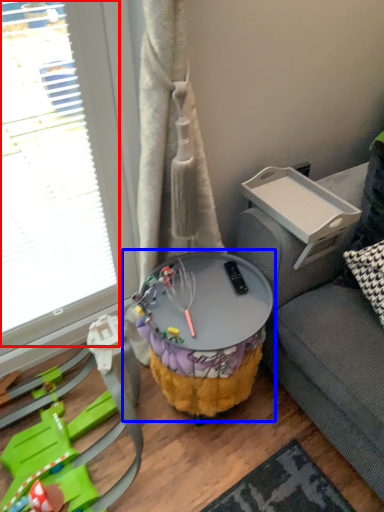
Question: Which of the following is the farthest to the observer, glass door (highlighted by a red box) or table (highlighted by a blue box)?

Choices:
 (A) glass door
 (B) table

Answer: (B)